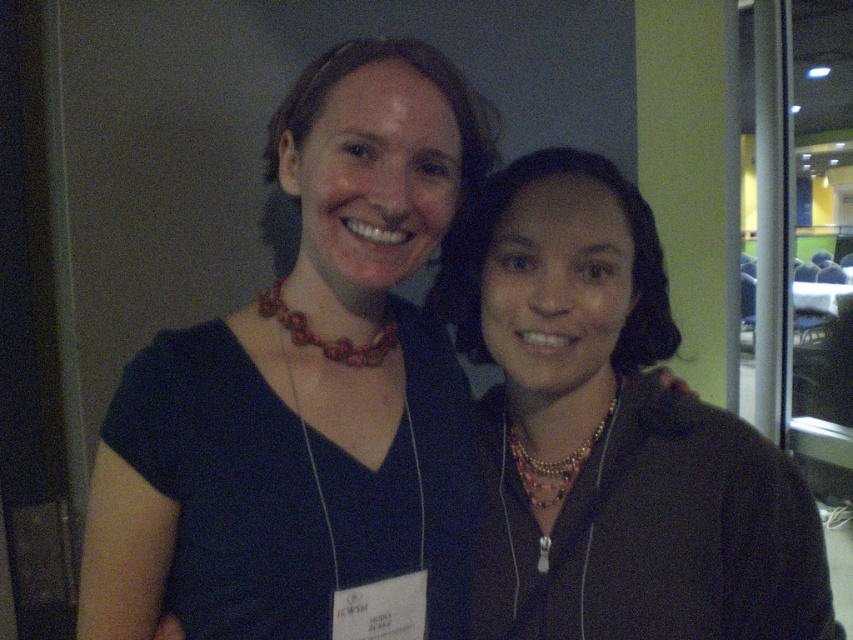
Question: Which of these objects is positioned farthest from the multicolored beaded necklace at center?

Choices:
 (A) wooden beads necklace at center
 (B) pearl-like beads necklace at center

Answer: (A)

Question: Among these points, which one is nearest to the camera?

Choices:
 (A) (601, 429)
 (B) (328, 356)

Answer: (B)

Question: Can you confirm if wooden beads necklace at center is positioned to the right of pearl-like beads necklace at center?

Choices:
 (A) no
 (B) yes

Answer: (A)

Question: Which point is closer to the camera?

Choices:
 (A) (554, 492)
 (B) (805, 536)

Answer: (B)

Question: Considering the relative positions of multicolored beaded necklace at center and pearl-like beads necklace at center in the image provided, where is multicolored beaded necklace at center located with respect to pearl-like beads necklace at center?

Choices:
 (A) right
 (B) left

Answer: (A)

Question: Does multicolored beaded necklace at center appear over wooden beads necklace at center?

Choices:
 (A) no
 (B) yes

Answer: (A)